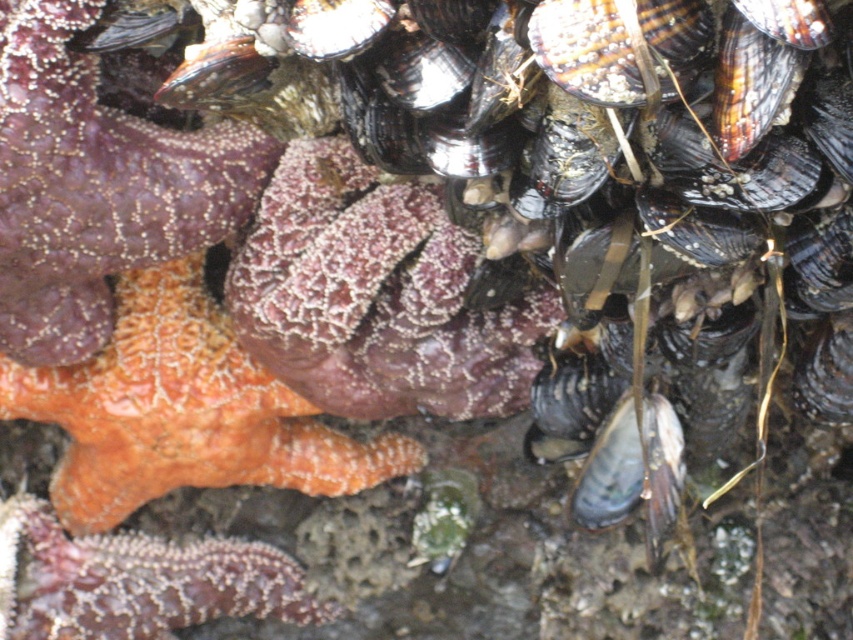
Between orange rough starfish at upper left and orange sponge at center, which one is positioned higher?

orange rough starfish at upper left is above.

Is orange rough starfish at upper left thinner than orange sponge at center?

Correct, orange rough starfish at upper left's width is less than orange sponge at center's.

Who is more forward, (115, 272) or (213, 476)?

Positioned in front is point (115, 272).

Identify the location of orange rough starfish at upper left. The height and width of the screenshot is (640, 853). (96, 186).

Which is behind, point (146, 387) or point (136, 538)?

Point (136, 538)

Is orange sponge at center taller than orange textured starfish at lower left?

Indeed, orange sponge at center has a greater height compared to orange textured starfish at lower left.

You are a GUI agent. You are given a task and a screenshot of the screen. Output one action in this format:
    pyautogui.click(x=<x>, y=<y>)
    Task: Click on the orange sponge at center
    The height and width of the screenshot is (640, 853).
    Given the screenshot: What is the action you would take?
    tap(183, 412)

Is orange rough starfish at upper left wider than orange textured starfish at lower left?

No, orange rough starfish at upper left is not wider than orange textured starfish at lower left.

Can you confirm if orange rough starfish at upper left is smaller than orange textured starfish at lower left?

No.

Is point (39, 344) more distant than point (119, 570)?

No, (39, 344) is closer to viewer.

Locate an element on the screen. orange rough starfish at upper left is located at coordinates (96, 186).